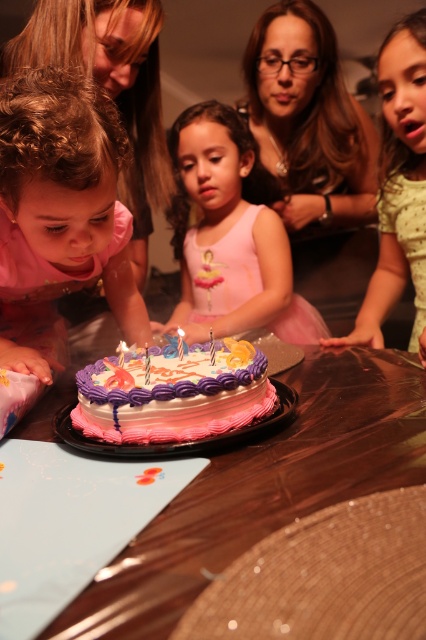
Question: Which point is closer to the camera?

Choices:
 (A) light green dotted shirt at right
 (B) pink frosted cake at center
 (C) wooden table at center
 (D) pink satin dress at center

Answer: (C)

Question: Estimate the real-world distances between objects in this image. Which object is farther from the pink satin dress at center?

Choices:
 (A) white wax candle at center
 (B) light green dotted shirt at right
 (C) pink frosted cake at center
 (D) pink fabric at left

Answer: (A)

Question: Where is pink satin dress at center located in relation to white wax candle at center in the image?

Choices:
 (A) below
 (B) above

Answer: (B)

Question: Can you confirm if pink fabric at left is thinner than light green dotted shirt at right?

Choices:
 (A) no
 (B) yes

Answer: (B)

Question: Which object appears closest to the camera in this image?

Choices:
 (A) white paper birthday candle at center
 (B) light green dotted shirt at right

Answer: (A)

Question: Is light green dotted shirt at right in front of white wax candle at center?

Choices:
 (A) yes
 (B) no

Answer: (B)